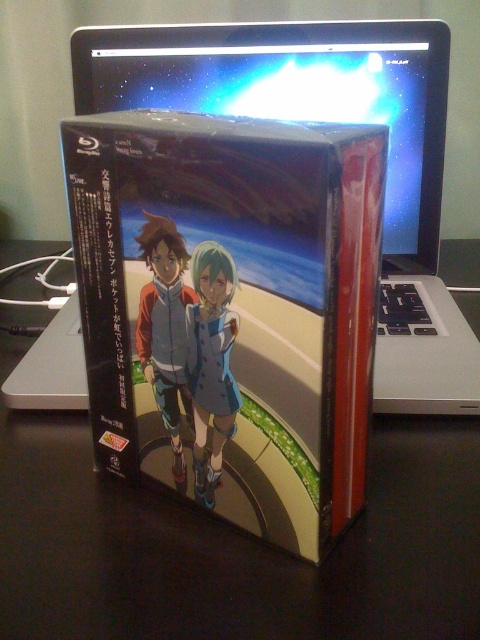
You are a delivery person who needs to place a large package on the table. The package is 12 inches wide. Can you fit it between the black matte table at center and the silver metallic laptop at upper center?

The distance between the black matte table at center and the silver metallic laptop at upper center is 10.29 inches. Since the package is 12 inches wide, it cannot fit in the space between them.

You are holding a smartphone that is 6.2 inches wide. You want to place it on the black matte table at center. Can you fit it entirely on the table without any part hanging off?

The black matte table at center is 12.16 inches away from the camera. Since the distance does not indicate the table size, we cannot determine if the smartphone will fit. More information about the table dimensions is needed.

You are standing in front of the Blu Ray box of Uruca Seven. There are two points on the box labeled as point (441, 540) and point (242, 108). If you were to look at the box from your current position, which point would appear closer to you?

Point (441, 540) is in front of point (242, 108), so it would appear closer to you.